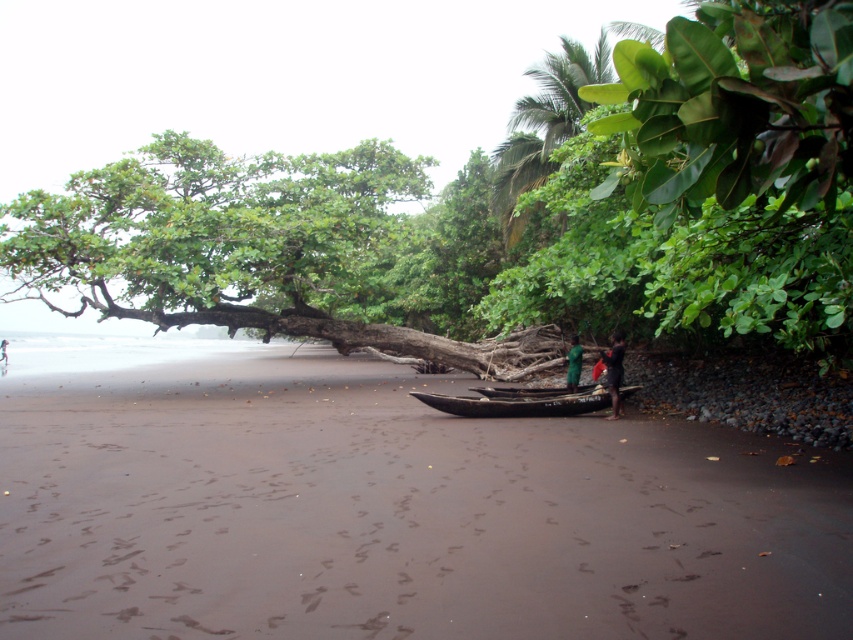
Who is higher up, black wood boat at center or dark brown wooden canoe at center?

black wood boat at center

Who is taller, black wood boat at center or dark brown wooden canoe at center?

black wood boat at center is taller.

Is point (525, 408) in front of point (622, 396)?

Yes, it is.

The height and width of the screenshot is (640, 853). I want to click on black wood boat at center, so click(x=518, y=403).

Between black wood boat at center and green fabric person at center, which one has more height?

Standing taller between the two is green fabric person at center.

Is black wood boat at center below green fabric person at center?

Indeed, black wood boat at center is positioned under green fabric person at center.

Who is more distant from viewer, (459, 401) or (579, 353)?

Positioned behind is point (579, 353).

Locate an element on the screen. The image size is (853, 640). black wood boat at center is located at coordinates (518, 403).

Describe the element at coordinates (396, 513) in the screenshot. I see `brown sandy beach at center` at that location.

Which is behind, point (535, 560) or point (3, 232)?

Positioned behind is point (3, 232).

Does point (514, 524) lie in front of point (390, 330)?

Yes, it is.

You are a GUI agent. You are given a task and a screenshot of the screen. Output one action in this format:
    pyautogui.click(x=<x>, y=<y>)
    Task: Click on the brown sandy beach at center
    The width and height of the screenshot is (853, 640).
    Given the screenshot: What is the action you would take?
    pyautogui.click(x=396, y=513)